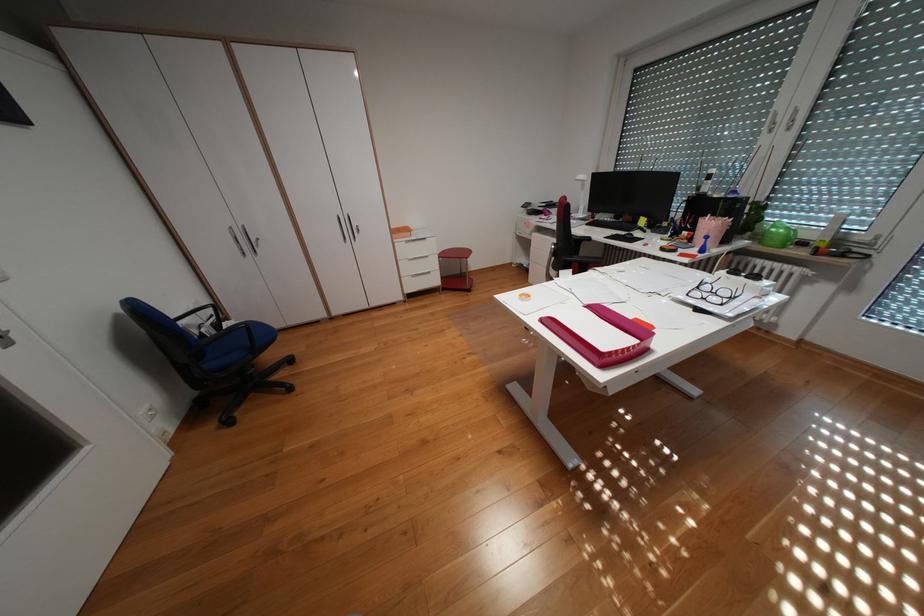
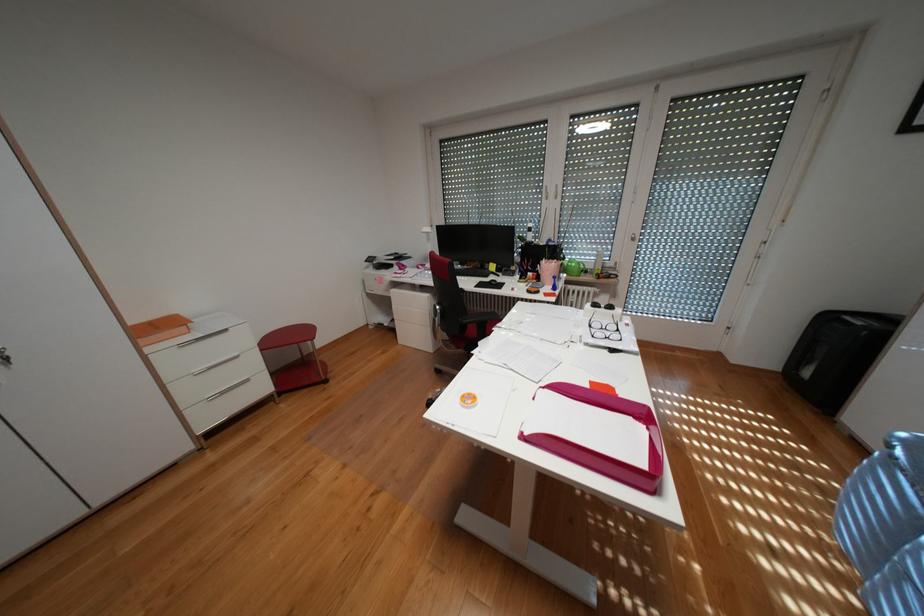
Find the pixel in the second image that matches the point at 710,286 in the first image.

(602, 325)